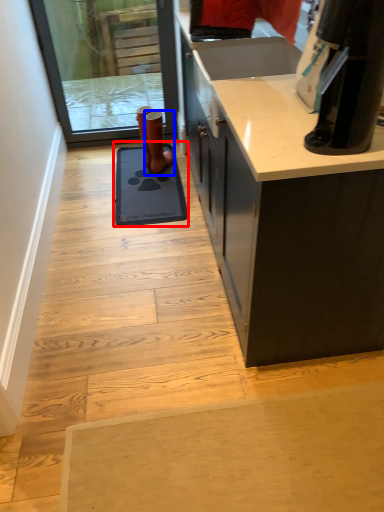
Question: Which object is closer to the camera taking this photo, doormat (highlighted by a red box) or footwear (highlighted by a blue box)?

Choices:
 (A) doormat
 (B) footwear

Answer: (A)